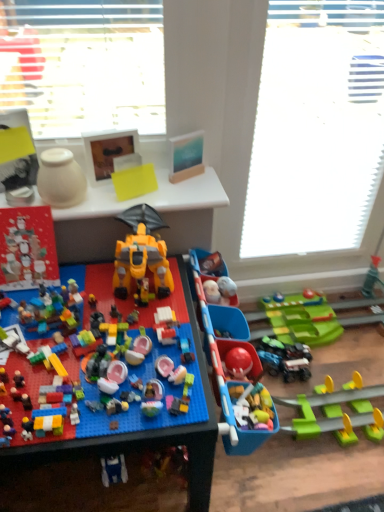
Where is `vacant area that lies to the right of white matte vase at upper left, the second toy viewed from the left`? Image resolution: width=384 pixels, height=512 pixels. vacant area that lies to the right of white matte vase at upper left, the second toy viewed from the left is located at coordinates (130, 192).